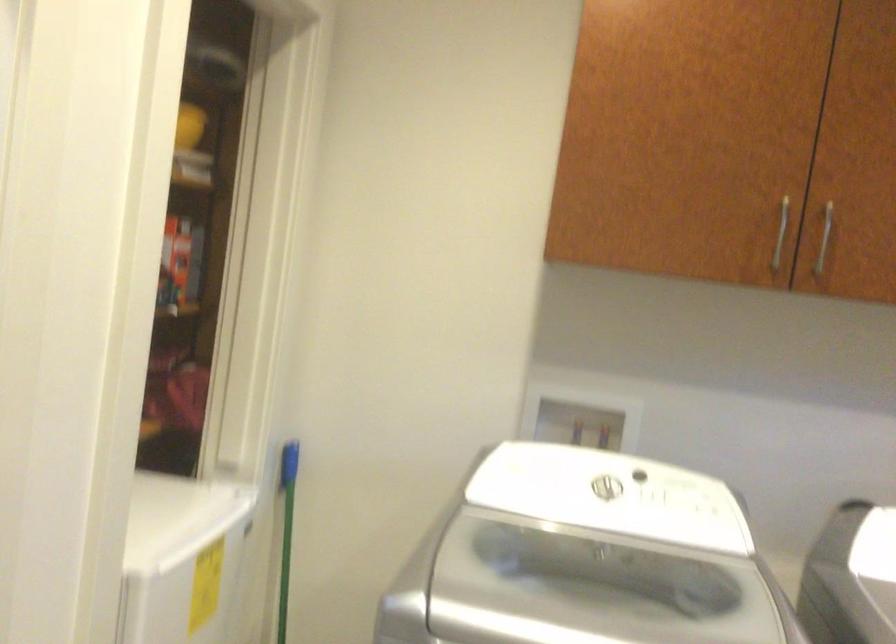
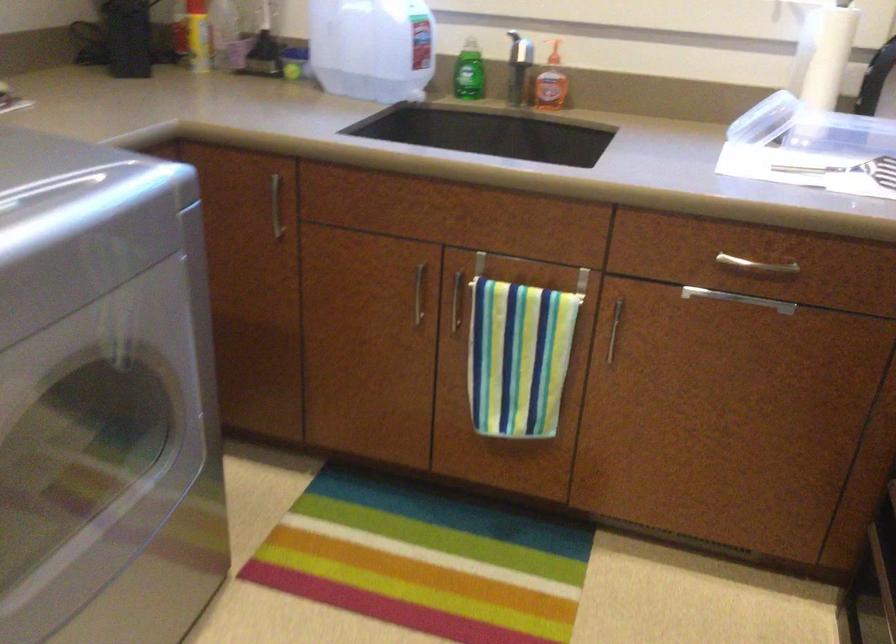
The images are taken continuously from a first-person perspective. In which direction is your viewpoint rotating?

The rotation direction of the camera is right-down.